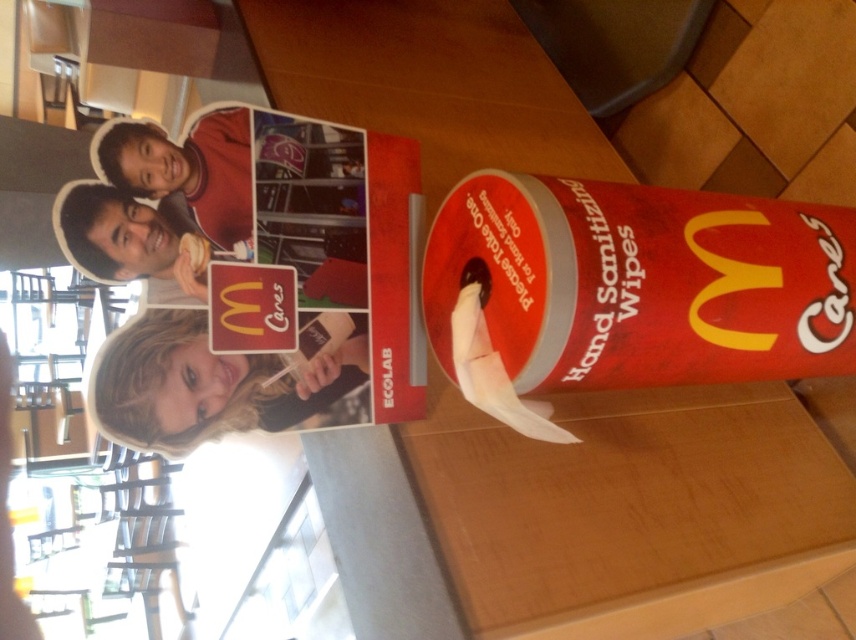
Question: Is the position of wooden table at center less distant than that of white paper at center?

Choices:
 (A) yes
 (B) no

Answer: (B)

Question: Which point is closer to the camera taking this photo?

Choices:
 (A) (209, 428)
 (B) (462, 369)
 (C) (108, 138)

Answer: (C)

Question: Which of the following is the farthest from the observer?

Choices:
 (A) (687, 566)
 (B) (527, 408)
 (C) (352, 332)

Answer: (A)

Question: Is matte black headband at upper left thinner than white paper at center?

Choices:
 (A) yes
 (B) no

Answer: (B)

Question: Which point is farther to the camera?

Choices:
 (A) matte black headband at upper left
 (B) wooden table at center
 (C) white paper at center

Answer: (B)

Question: Is wooden table at center to the right of matte black headband at upper left from the viewer's perspective?

Choices:
 (A) yes
 (B) no

Answer: (A)